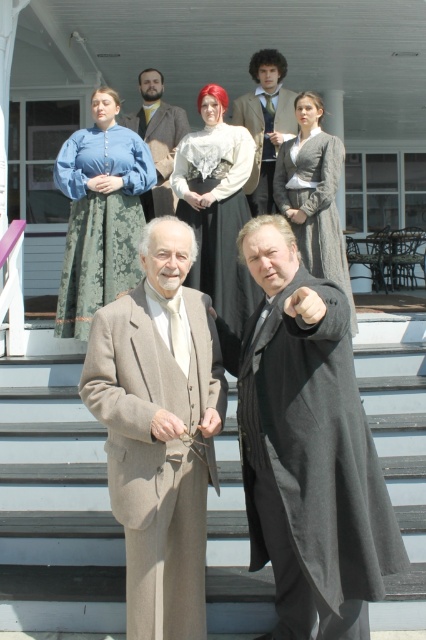
Question: Can you confirm if black woolen robe at center is positioned below brown wool coat at upper center?

Choices:
 (A) no
 (B) yes

Answer: (B)

Question: Which object is farther from the camera taking this photo?

Choices:
 (A) black satin dress at center
 (B) brown wool coat at upper center
 (C) gray wool dress at center
 (D) matte blue fabric dress at upper left

Answer: (B)

Question: Does gray wool dress at center have a smaller size compared to brown wool coat at upper center?

Choices:
 (A) no
 (B) yes

Answer: (A)

Question: Which of the following is the closest to the observer?

Choices:
 (A) pyautogui.click(x=218, y=182)
 (B) pyautogui.click(x=120, y=486)

Answer: (B)

Question: From the image, what is the correct spatial relationship of light brown wool suit at center in relation to brown wool coat at upper center?

Choices:
 (A) left
 (B) right

Answer: (A)

Question: Which is farther from the light brown wool suit at center?

Choices:
 (A) black woolen robe at center
 (B) gray wool dress at center
 (C) smooth gray stairs at center

Answer: (B)